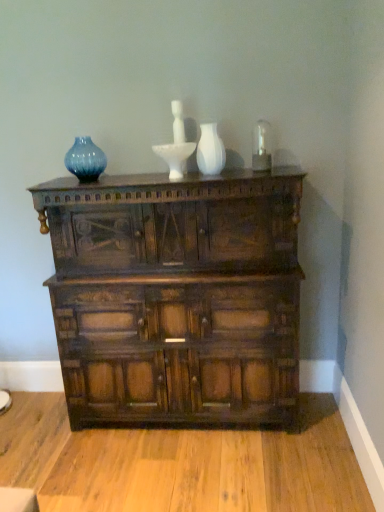
Question: Visually, is white glossy vase at center positioned to the left or to the right of dark wood chest of drawers at center?

Choices:
 (A) right
 (B) left

Answer: (A)

Question: Does point (223, 153) appear closer or farther from the camera than point (102, 291)?

Choices:
 (A) farther
 (B) closer

Answer: (A)

Question: Considering the real-world distances, which object is farthest from the blue glass vase at upper left?

Choices:
 (A) dark wood chest of drawers at center
 (B) white glossy vase at center

Answer: (A)

Question: Which object is the farthest from the dark wood chest of drawers at center?

Choices:
 (A) white glossy vase at center
 (B) blue glass vase at upper left

Answer: (B)